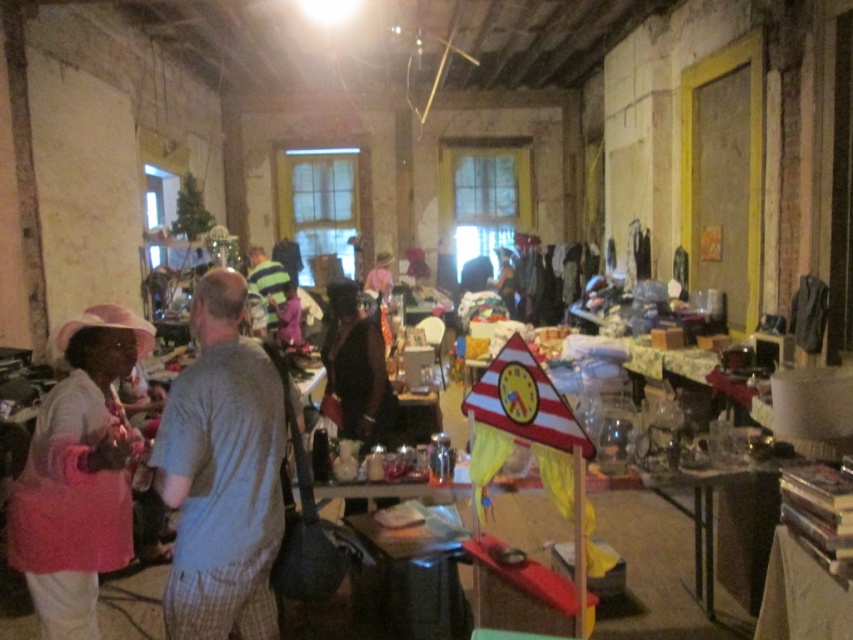
Looking at this image, does pink fabric apron at left have a greater height compared to brown leather jacket at center?

Correct, pink fabric apron at left is much taller as brown leather jacket at center.

Between point (97, 564) and point (332, 305), which one is positioned behind?

Point (332, 305)

Locate an element on the screen. The height and width of the screenshot is (640, 853). pink fabric apron at left is located at coordinates (79, 474).

In the scene shown: Is gray cotton shirt at center positioned at the back of brown leather jacket at center?

That is False.

Does point (187, 525) lie behind point (367, 323)?

No, (187, 525) is in front of (367, 323).

The width and height of the screenshot is (853, 640). Identify the location of gray cotton shirt at center. (222, 474).

Does point (207, 452) come behind point (64, 554)?

No, it is in front of (64, 554).

Which is behind, point (190, 317) or point (119, 518)?

Positioned behind is point (119, 518).

What do you see at coordinates (222, 474) in the screenshot? I see `gray cotton shirt at center` at bounding box center [222, 474].

This screenshot has width=853, height=640. Identify the location of gray cotton shirt at center. (222, 474).